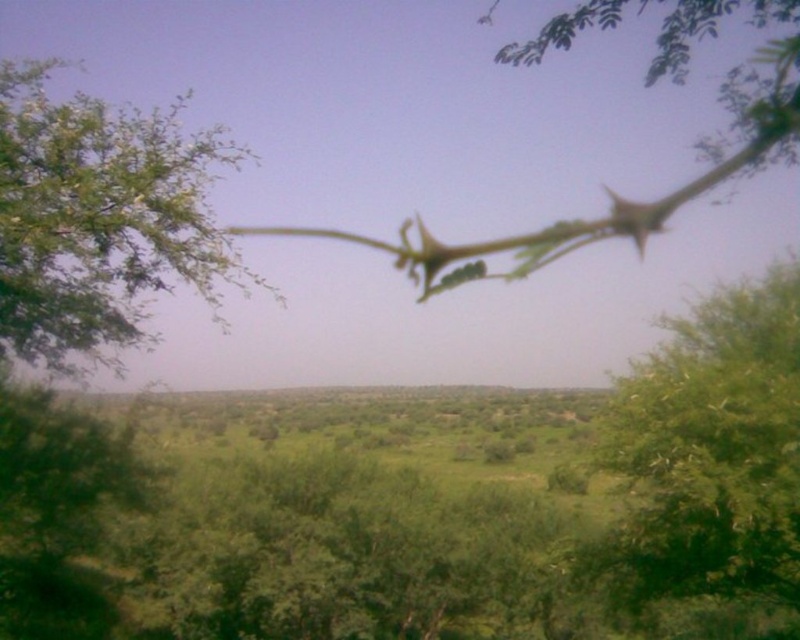
You are an outdoor photographer planning to capture a landscape photo. You want to include both the green leafy tree at center and the green leafy tree at upper left in your shot. Based on their positions, which tree will appear smaller in the final photo?

The green leafy tree at upper left appears smaller because it is positioned further away from the camera compared to the green leafy tree at center.

You are a hiker trying to determine which tree is narrower between the green leafy tree at center and the green leafy tree at upper left. Based on the scene, which one is narrower?

The green leafy tree at center is narrower than the green leafy tree at upper left.